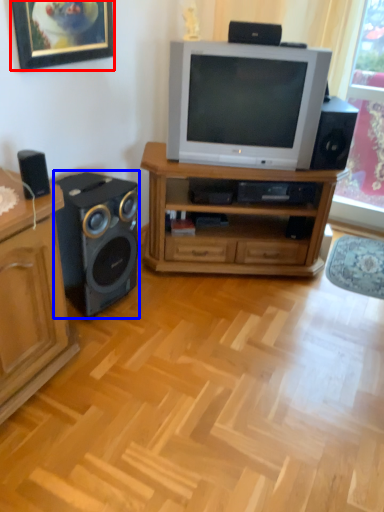
Question: Which of the following is the farthest to the observer, picture frame (highlighted by a red box) or loudspeaker (highlighted by a blue box)?

Choices:
 (A) picture frame
 (B) loudspeaker

Answer: (B)